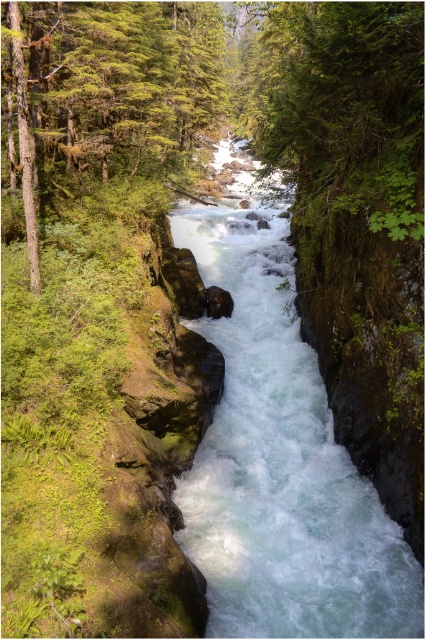
You are a photographer planning to capture the entire scene of the clear water at center and the green mossy tree at upper left in one shot. Based on their sizes, which one will occupy more space in the photo?

The clear water at center occupies more space in the photo because it is bigger than the green mossy tree at upper left according to the description.

You are standing at the edge of the river in the forested canyon scene. There is a point marked at coordinates (279, 458). Based on the description, what type of water feature is located at this point?

The point at coordinates (279, 458) corresponds to clear water at center, which is part of the river with vibrant blue green water and strong currents.

You are a photographer standing at the edge of the river in the forest canyon scene. You want to take a photo that includes both the point at coordinates point (333, 461) and point (134, 67). Which point will appear larger in your photo?

Point (333, 461) will appear larger in the photo because it is closer to the camera than point (134, 67).